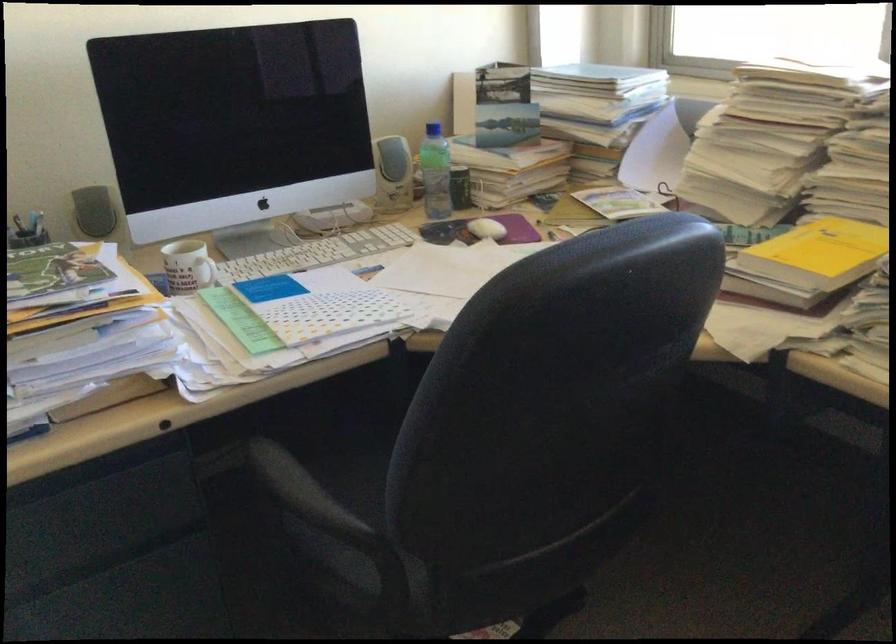
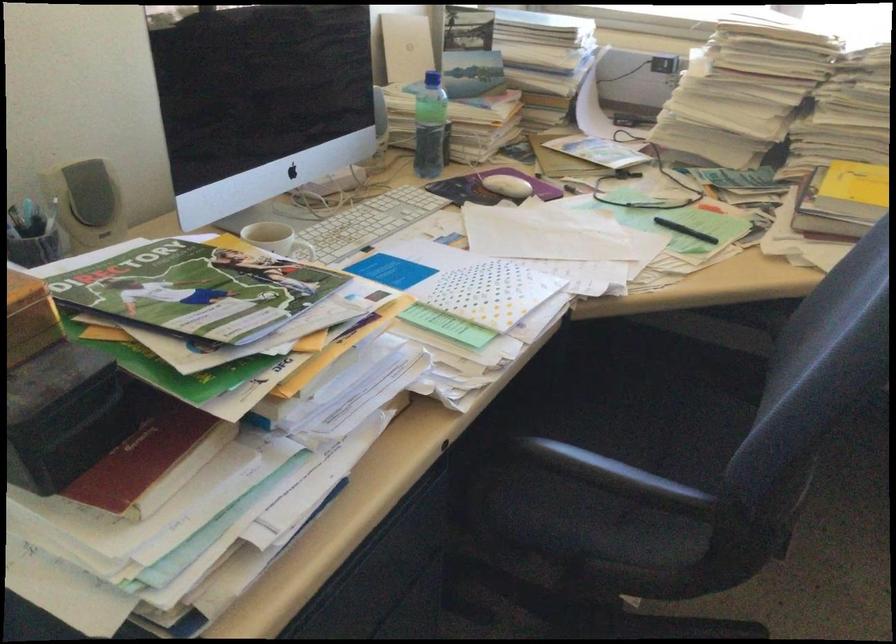
In the second image, find the point that corresponds to point (278, 480) in the first image.

(614, 474)